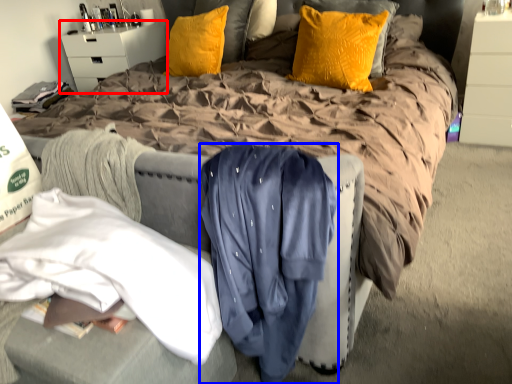
Question: Which point is closer to the camera, nightstand (highlighted by a red box) or clothing (highlighted by a blue box)?

Choices:
 (A) nightstand
 (B) clothing

Answer: (B)